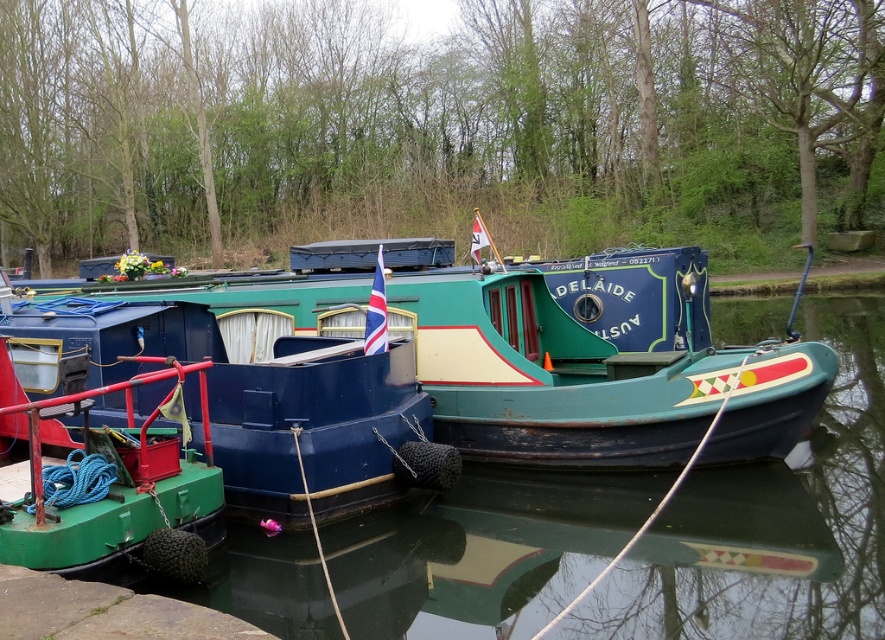
Is matte blue boat at center smaller than brown stone dock at lower left?

Actually, matte blue boat at center might be larger than brown stone dock at lower left.

This screenshot has height=640, width=885. What are the coordinates of `matte blue boat at center` in the screenshot? It's located at (259, 400).

Is point (449, 461) in front of point (133, 630)?

No.

Image resolution: width=885 pixels, height=640 pixels. What are the coordinates of `matte blue boat at center` in the screenshot? It's located at (259, 400).

Does teal wooden boat at center have a smaller size compared to matte blue boat at center?

No.

Which is in front, point (647, 289) or point (304, 381)?

Point (304, 381)

Is point (613, 445) farther from viewer compared to point (286, 464)?

Yes, point (613, 445) is farther from viewer.

Where is `teal wooden boat at center`? The width and height of the screenshot is (885, 640). teal wooden boat at center is located at coordinates (539, 349).

Who is higher up, green matte boat at left or brown stone dock at lower left?

green matte boat at left is higher up.

What do you see at coordinates (110, 492) in the screenshot? Image resolution: width=885 pixels, height=640 pixels. I see `green matte boat at left` at bounding box center [110, 492].

Where is `green matte boat at left`? The width and height of the screenshot is (885, 640). green matte boat at left is located at coordinates (110, 492).